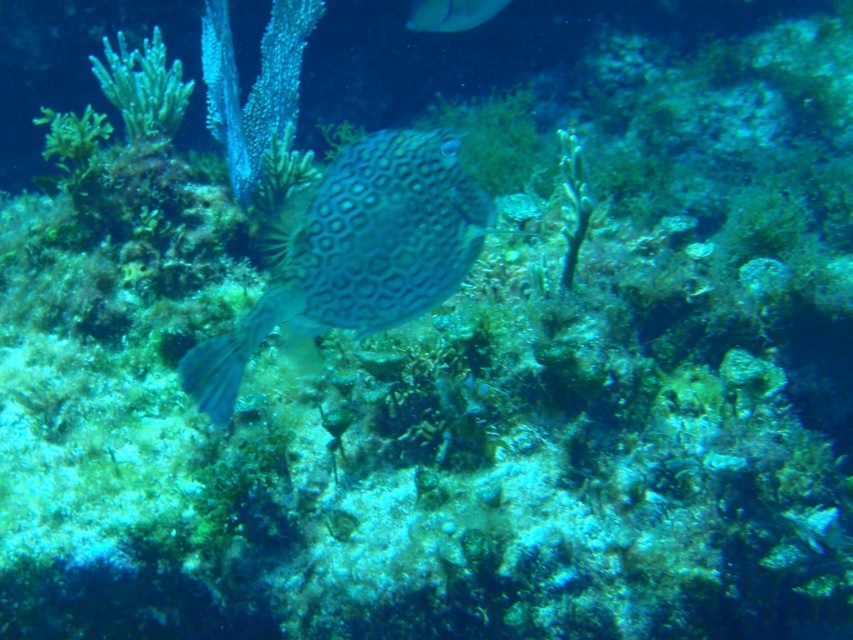
Measure the distance between green matte algae at upper left and camera.

green matte algae at upper left is 7.31 feet from camera.

Between point (115, 97) and point (485, 20), which one is positioned behind?

The point (485, 20) is more distant.

Where is `green matte algae at upper left`? Image resolution: width=853 pixels, height=640 pixels. green matte algae at upper left is located at coordinates tap(143, 88).

Describe the element at coordinates (355, 253) in the screenshot. I see `patterned skin fish at center` at that location.

Where is `patterned skin fish at center`? This screenshot has width=853, height=640. patterned skin fish at center is located at coordinates (355, 253).

Is point (305, 244) positioned in front of point (434, 12)?

Yes.

Who is positioned more to the right, patterned skin fish at center or smooth yellow fish at upper center?

smooth yellow fish at upper center

Who is more forward, (309, 300) or (456, 22)?

Point (309, 300) is in front.

Where is `patterned skin fish at center`? patterned skin fish at center is located at coordinates (355, 253).